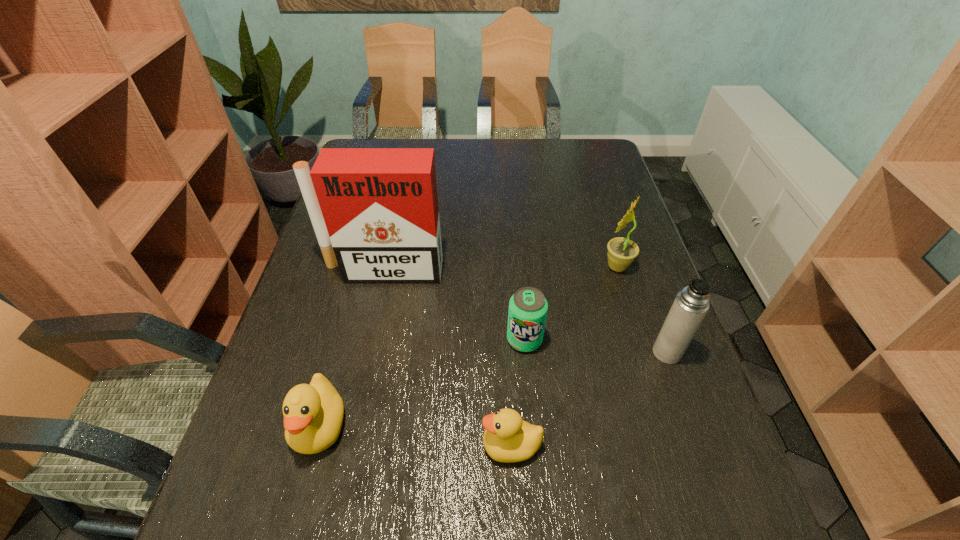
What are the coordinates of `vacant area that lies between the pop soda and the sunflower` in the screenshot? It's located at (570, 303).

The image size is (960, 540). Identify the location of unoccupied position between the sunflower and the tallest object. (x=500, y=268).

Where is `vacant area that lies between the taller duck and the right duck`? The height and width of the screenshot is (540, 960). vacant area that lies between the taller duck and the right duck is located at coordinates (416, 435).

This screenshot has width=960, height=540. What are the coordinates of `vacant space that's between the tallest object and the taller duck` in the screenshot? It's located at (351, 348).

Identify which object is located as the fifth nearest to the thermos bottle. Please provide its 2D coordinates. Your answer should be formatted as a tuple, i.e. [(x, y)], where the tuple contains the x and y coordinates of a point satisfying the conditions above.

[(313, 413)]

Identify which object is located as the fourth nearest to the tallest object. Please provide its 2D coordinates. Your answer should be formatted as a tuple, i.e. [(x, y)], where the tuple contains the x and y coordinates of a point satisfying the conditions above.

[(621, 253)]

Find the location of a particular element. The image size is (960, 540). blank area in the image that satisfies the following two spatial constraints: 1. on the face of the sunflower; 2. on the front-facing side of the pop soda is located at coordinates (639, 340).

You are a GUI agent. You are given a task and a screenshot of the screen. Output one action in this format:
    pyautogui.click(x=<x>, y=<y>)
    Task: Click on the free space that satisfies the following two spatial constraints: 1. on the back side of the thermos bottle; 2. on the face of the sunflower
    The image size is (960, 540).
    Given the screenshot: What is the action you would take?
    pyautogui.click(x=636, y=267)

You are a GUI agent. You are given a task and a screenshot of the screen. Output one action in this format:
    pyautogui.click(x=<x>, y=<y>)
    Task: Click on the vacant area that satisfies the following two spatial constraints: 1. on the face of the sunflower; 2. on the left side of the thermos bottle
    
    Given the screenshot: What is the action you would take?
    pyautogui.click(x=643, y=353)